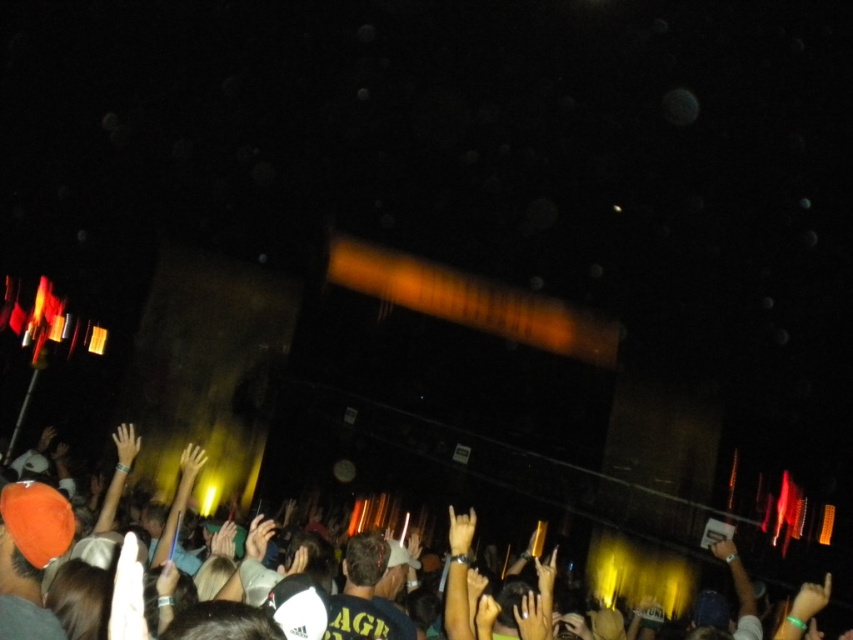
In the concert scene, there is a point at coordinates (x=643, y=572). What object is located at this point?

The orange fabric hat at lower left is located at point (x=643, y=572).

You are standing at the center of the concert venue and want to find the orange fabric hat at lower left. According to the coordinates provided, in which direction should you move to locate it?

The orange fabric hat at lower left is located at point [643,572]. Since the coordinates are given as x and y values between 0 and 1, with lower left being the origin, you should move towards the lower left direction to find it.

You are a stagehand who needs to place a prop between the orange fabric hat at lower left and the light brown leather hand at center. The prop requires at least 5 meters of space to be safely placed. Can you safely place the prop in this location?

The orange fabric hat at lower left is 4.72 meters from the light brown leather hand at center, which is less than the required 5 meters. Therefore, the prop cannot be safely placed between them due to insufficient space.